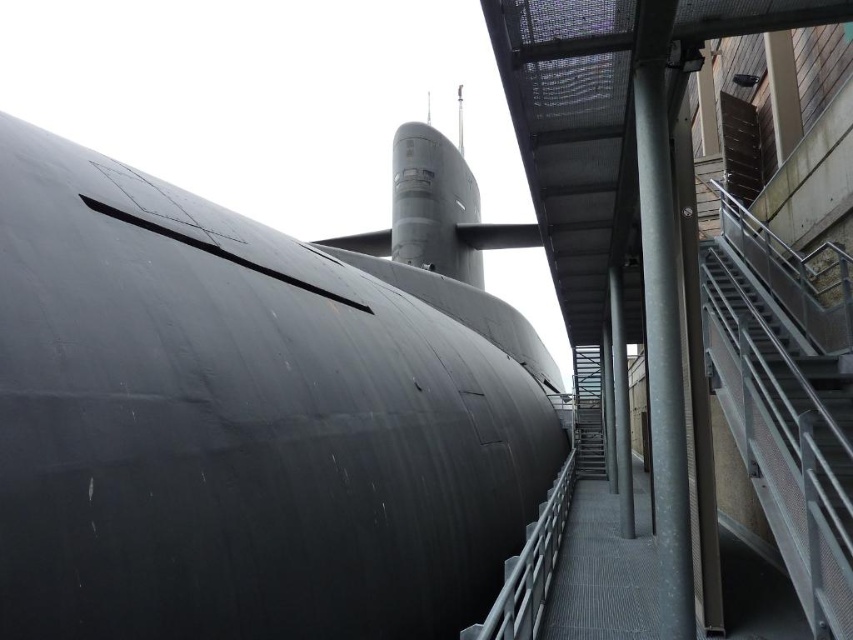
You are standing in front of the submarine and want to walk towards the staircase. Which direction should you move to get closer to the metallic gray staircase at right while staying in front of the matte black submarine at center?

You should move to the right while staying in front of the matte black submarine at center, as the metallic gray staircase at right is located to its right side.

You are standing in front of the matte black submarine at center and want to place a 1.8 meter long ladder against it. Can you fit the ladder horizontally without it extending beyond the submarine?

The distance between you and the matte black submarine at center is 2.07 meters, which is greater than the ladder length of 1.8 meters. Therefore, the ladder can be placed horizontally without extending beyond the submarine.